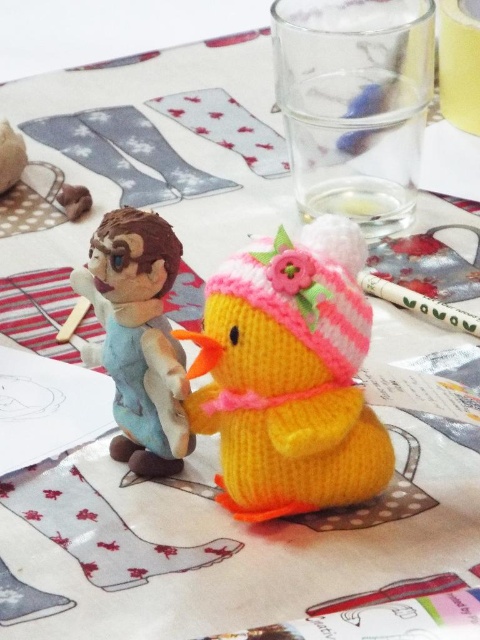
You are a child who wants to stack the knitted yellow duckling at center and the fuzzy brown monkey at left on top of each other. Which one should you place at the bottom to ensure the stack doesn

The knitted yellow duckling at center is taller than the fuzzy brown monkey at left, so you should place the knitted yellow duckling at center at the bottom to ensure the stack is stable.

You are looking at the table scene. There are two points marked on the tablecloth. The first point is at coordinate [243,474] and the second point is at coordinate [105,312]. From your perspective, which point is closer to you?

Point [243,474] is in front of point [105,312], so it is closer to you.